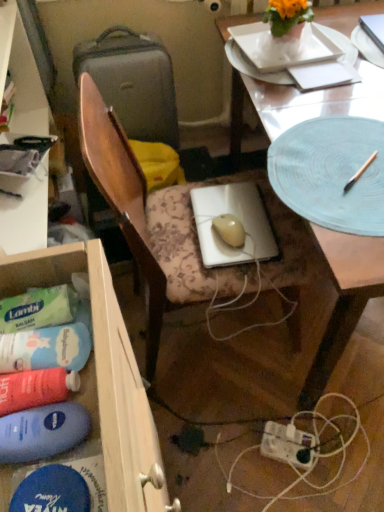
The height and width of the screenshot is (512, 384). Find the location of `vacant area on the back side of light blue textured platter at upper right`. vacant area on the back side of light blue textured platter at upper right is located at coordinates (316, 84).